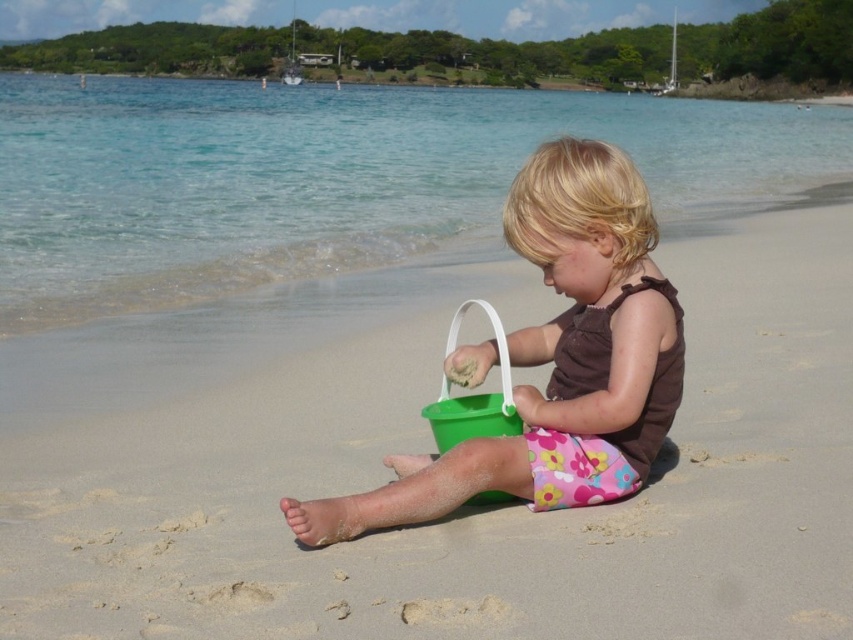
Question: Considering the real-world distances, which object is closest to the matte green bucket at center?

Choices:
 (A) green matte bucket at center
 (B) clear blue water at upper center

Answer: (A)

Question: Which of the following is the farthest from the observer?

Choices:
 (A) (750, 376)
 (B) (465, 484)
 (C) (776, 173)

Answer: (C)

Question: Which object is positioned farthest from the clear blue water at upper center?

Choices:
 (A) green matte bucket at center
 (B) matte green bucket at center

Answer: (A)

Question: Is green matte bucket at center smaller than matte green bucket at center?

Choices:
 (A) yes
 (B) no

Answer: (A)

Question: Does green matte bucket at center appear over matte green bucket at center?

Choices:
 (A) yes
 (B) no

Answer: (B)

Question: Does green matte bucket at center have a greater width compared to clear blue water at upper center?

Choices:
 (A) no
 (B) yes

Answer: (A)